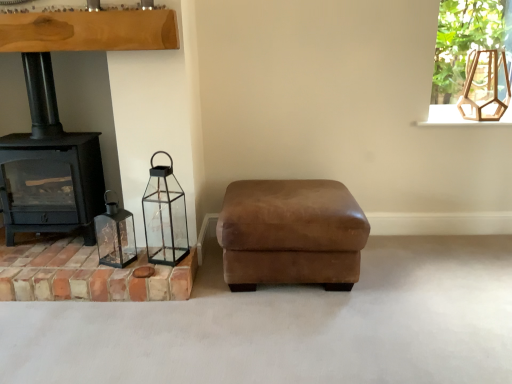
Locate an element on the screen. vacant space situated on the left part of black glass lantern at lower left, the 1th candle holder in the right-to-left sequence is located at coordinates (131, 251).